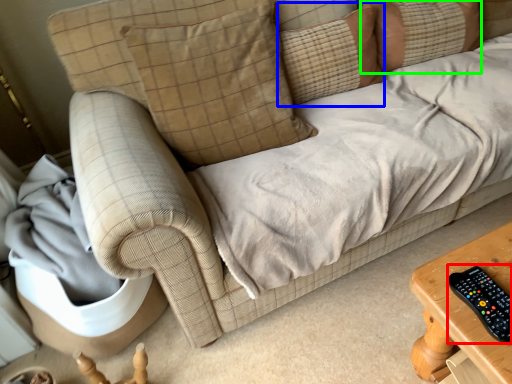
Question: Estimate the real-world distances between objects in this image. Which object is closer to control (highlighted by a red box), pillow (highlighted by a blue box) or pillow (highlighted by a green box)?

Choices:
 (A) pillow
 (B) pillow

Answer: (A)